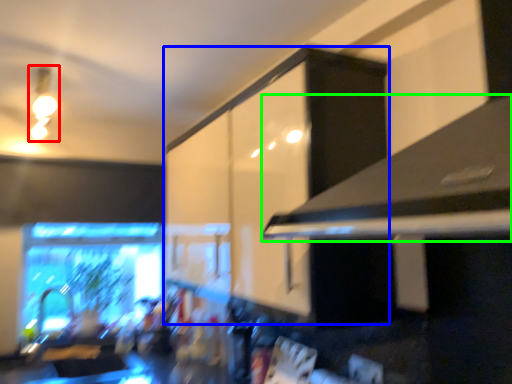
Question: Considering the real-world distances, which object is closest to light fixture (highlighted by a red box)? cabinetry (highlighted by a blue box) or exhaust hood (highlighted by a green box).

Choices:
 (A) cabinetry
 (B) exhaust hood

Answer: (A)